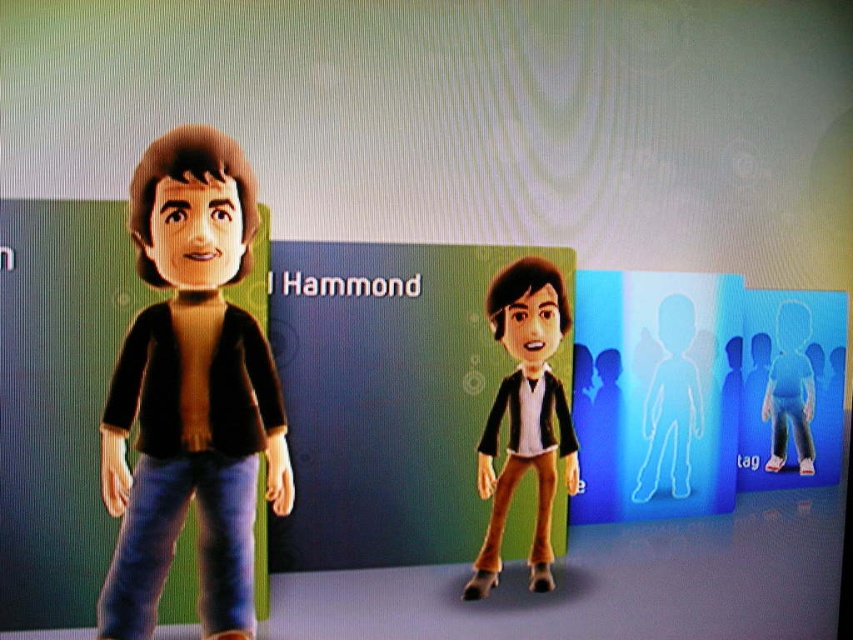
Describe the element at coordinates (670, 403) in the screenshot. This screenshot has height=640, width=853. I see `transparent plastic figure at center` at that location.

Is transparent plastic figure at center positioned before transparent blue figure at center?

That is True.

Where is `transparent plastic figure at center`? Image resolution: width=853 pixels, height=640 pixels. transparent plastic figure at center is located at coordinates (670, 403).

Who is positioned more to the left, matte black jacket at left or transparent plastic figure at center?

matte black jacket at left

Between point (204, 609) and point (682, 369), which one is positioned behind?

The point (682, 369) is more distant.

Where is `matte black jacket at left`? This screenshot has height=640, width=853. matte black jacket at left is located at coordinates (190, 392).

Is matte black jacket at center shorter than transparent plastic figure at center?

In fact, matte black jacket at center may be taller than transparent plastic figure at center.

Between matte black jacket at center and transparent plastic figure at center, which one is positioned lower?

matte black jacket at center is lower down.

Is point (494, 522) more distant than point (653, 456)?

No.

You are a GUI agent. You are given a task and a screenshot of the screen. Output one action in this format:
    pyautogui.click(x=<x>, y=<y>)
    Task: Click on the matte black jacket at center
    Image resolution: width=853 pixels, height=640 pixels.
    Given the screenshot: What is the action you would take?
    pyautogui.click(x=525, y=416)